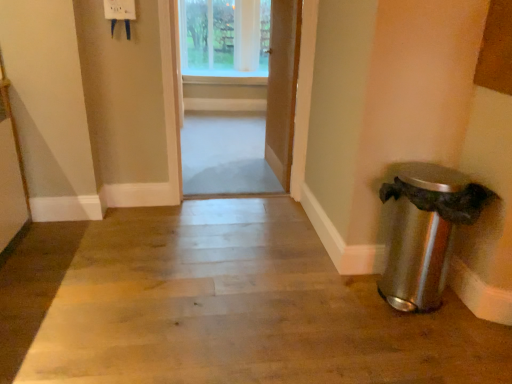
Question: Is wooden door at center, which is the first door from right to left, wider or thinner than wooden door at center, the first door when ordered from left to right?

Choices:
 (A) thin
 (B) wide

Answer: (A)

Question: Considering the positions of wooden door at center, which is the first door from right to left, and wooden door at center, the first door when ordered from left to right, in the image, is wooden door at center, which is the first door from right to left, bigger or smaller than wooden door at center, the first door when ordered from left to right,?

Choices:
 (A) big
 (B) small

Answer: (B)

Question: Considering the real-world distances, which object is closest to the wooden floor at center?

Choices:
 (A) clear glass window at upper center
 (B) wooden door at center, which ranks as the 2th door in right-to-left order
 (C) satin silver trash can at lower right
 (D) wooden door at center, which is the first door from right to left

Answer: (C)

Question: Estimate the real-world distances between objects in this image. Which object is farther from the clear glass window at upper center?

Choices:
 (A) wooden door at center, which is the first door from right to left
 (B) satin silver trash can at lower right
 (C) wooden floor at center
 (D) wooden door at center, the first door when ordered from left to right

Answer: (B)